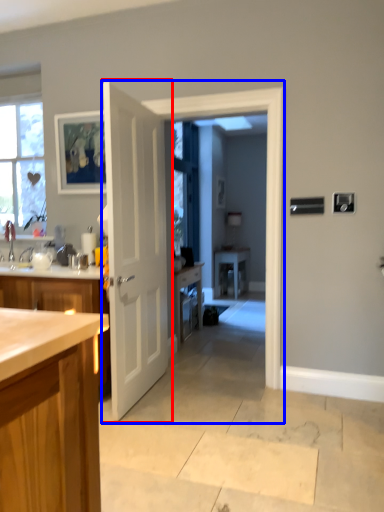
Question: Which object is closer to the camera taking this photo, door (highlighted by a red box) or screen door (highlighted by a blue box)?

Choices:
 (A) door
 (B) screen door

Answer: (A)